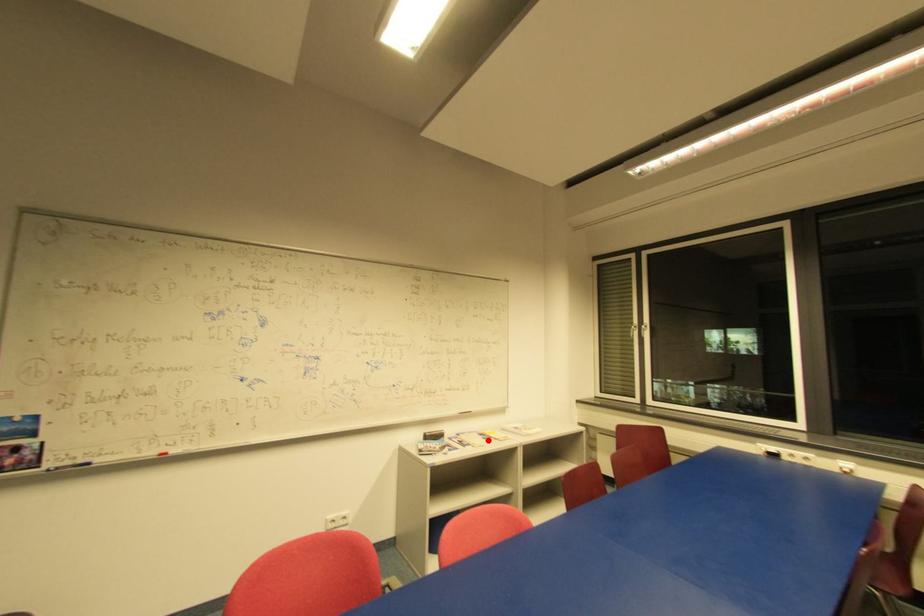
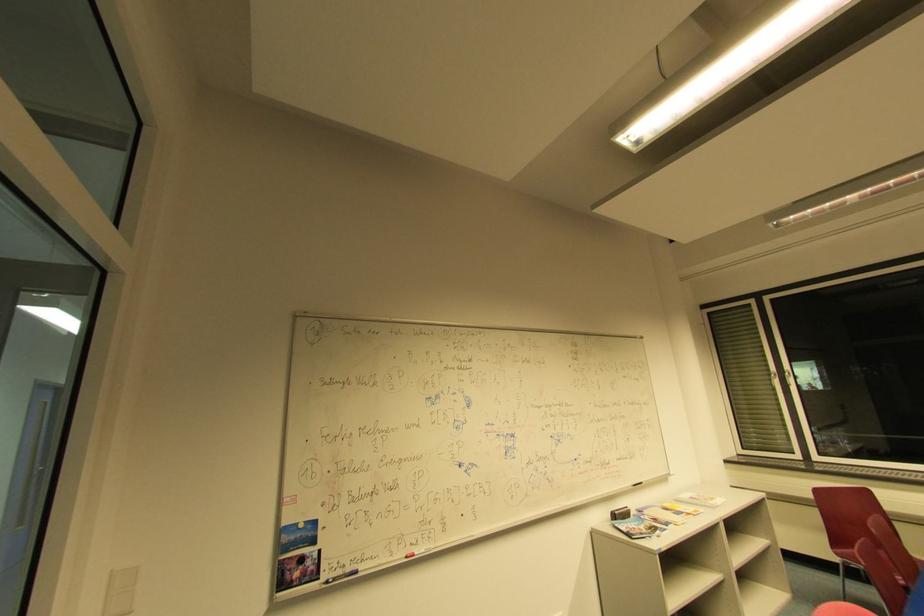
Question: I am providing you with two images of the same scene from different viewpoints. Given a red point in image1, look at the same physical point in image2. Is it:

Choices:
 (A) Closer to the viewpoint
 (B) Farther from the viewpoint

Answer: (A)